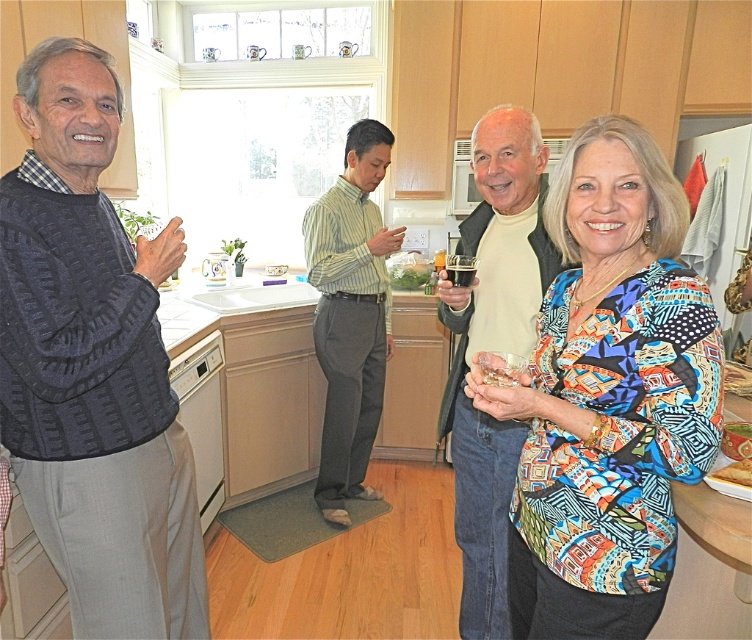
Is point (20, 316) farther from viewer compared to point (741, 474)?

No, it is in front of (741, 474).

Does knitted dark gray sweater at left have a smaller size compared to golden crispy bread at lower right?

Incorrect, knitted dark gray sweater at left is not smaller in size than golden crispy bread at lower right.

Who is more forward, (126, 484) or (731, 472)?

Point (731, 472) is in front.

The width and height of the screenshot is (752, 640). I want to click on knitted dark gray sweater at left, so click(92, 365).

Who is positioned more to the right, knitted dark gray sweater at left or translucent glass at center?

translucent glass at center is more to the right.

Is knitted dark gray sweater at left to the left of translucent glass at center from the viewer's perspective?

Indeed, knitted dark gray sweater at left is positioned on the left side of translucent glass at center.

Find the location of a particular element. knitted dark gray sweater at left is located at coordinates (92, 365).

Is printed fabric blouse at center wider than translucent glass at center?

Yes, printed fabric blouse at center is wider than translucent glass at center.

The height and width of the screenshot is (640, 752). What are the coordinates of `printed fabric blouse at center` in the screenshot? It's located at (608, 396).